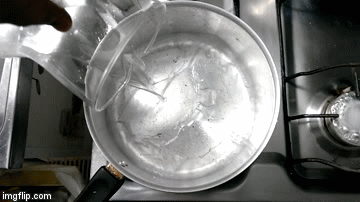
Locate an element on the screen. This screenshot has width=360, height=202. drip bowls is located at coordinates (326, 137).